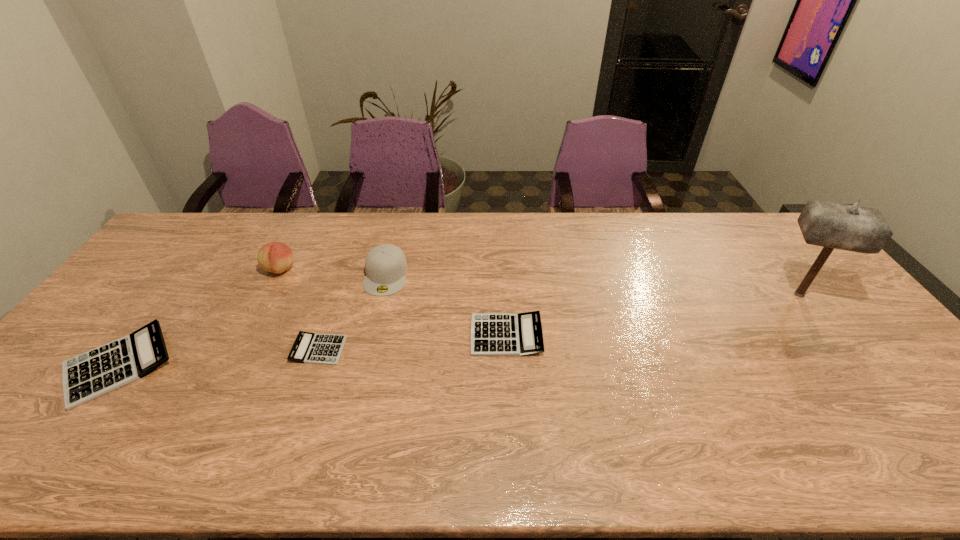
At what (x,y) coordinates should I click in order to perform the action: click on vacant area between the second object from left to right and the second shortest object. Please return your answer as a coordinate pair (x, y). The width and height of the screenshot is (960, 540). Looking at the image, I should click on (393, 302).

Find the location of a particular element. This screenshot has height=540, width=960. free spot between the fourth object from right to left and the fourth object from left to right is located at coordinates (352, 312).

Image resolution: width=960 pixels, height=540 pixels. In order to click on unoccupied position between the mallet and the leftmost calculator in this screenshot , I will do `click(459, 329)`.

You are a GUI agent. You are given a task and a screenshot of the screen. Output one action in this format:
    pyautogui.click(x=<x>, y=<y>)
    Task: Click on the free space between the rightmost object and the third object from right to left
    
    Given the screenshot: What is the action you would take?
    pyautogui.click(x=592, y=285)

Find the location of a particular element. the second closest object to the third object from left to right is located at coordinates (276, 257).

Locate an element on the screen. object that is the second closest to the second shortest calculator is located at coordinates (310, 348).

Image resolution: width=960 pixels, height=540 pixels. I want to click on calculator that can be found as the third closest to the peach, so click(x=492, y=334).

Locate which calculator is the closest to the second calculator from right to left. Please provide its 2D coordinates. Your answer should be formatted as a tuple, i.e. [(x, y)], where the tuple contains the x and y coordinates of a point satisfying the conditions above.

[(87, 376)]

This screenshot has width=960, height=540. What are the coordinates of `vacant point that satisfies the following two spatial constraints: 1. on the back side of the leftmost calculator; 2. on the right side of the peach` in the screenshot? It's located at (190, 269).

Where is `free spot that satisfies the following two spatial constraints: 1. on the back side of the tallest object; 2. on the right side of the leftmost object`? The image size is (960, 540). free spot that satisfies the following two spatial constraints: 1. on the back side of the tallest object; 2. on the right side of the leftmost object is located at coordinates (171, 294).